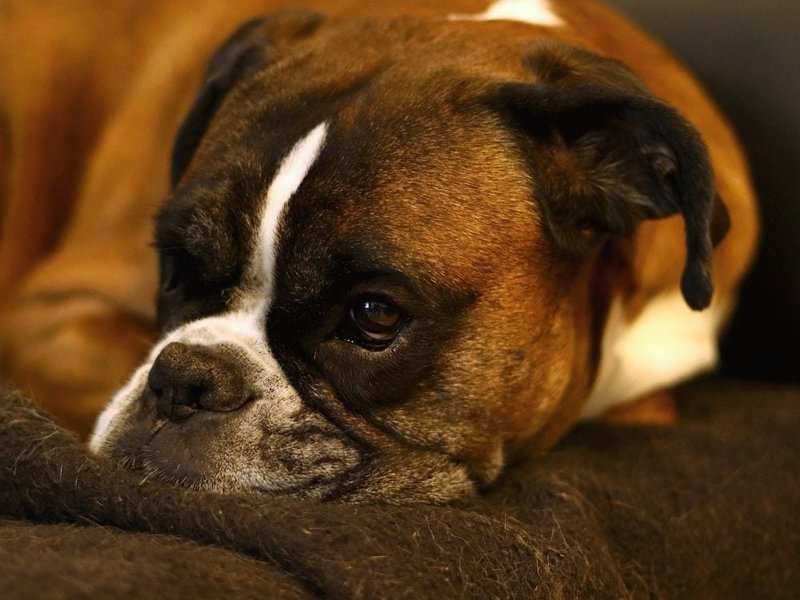
Image resolution: width=800 pixels, height=600 pixels. I want to click on white fur, so click(x=274, y=208).